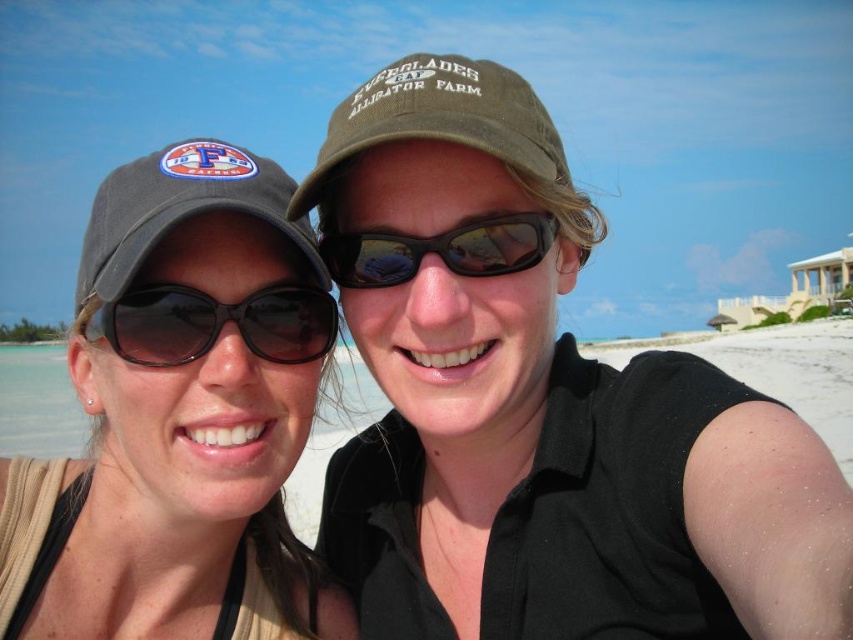
You are a photographer trying to capture a clear shot of the green fabric cap at upper center and the black matte sunglasses at center. Based on their positions, which object should you adjust your camera focus to first to ensure both are in frame?

The green fabric cap at upper center is positioned on the left side of black matte sunglasses at center. Therefore, you should focus on the green fabric cap at upper center first since it is closer to the left edge of the frame to ensure both objects remain in the shot.

You are a photographer trying to capture a closeup shot of the matte gray cap at upper left and the black matte sunglasses at left. If your camera can only focus on one object at a time, which object should you adjust the focus to first to ensure it fills the frame more when zoomed in?

The matte gray cap at upper left should be focused on first because it is wider than the black matte sunglasses at left, so zooming in on it will fill the frame more quickly.